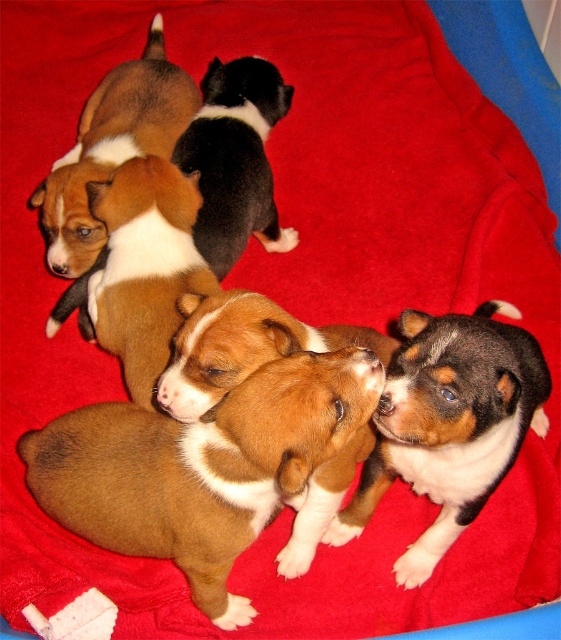
Does brown and white fur at center appear on the right side of black and white fur at center?

Correct, you'll find brown and white fur at center to the right of black and white fur at center.

Where is `brown and white fur at center`? brown and white fur at center is located at coordinates (448, 422).

Is brown/white fur puppy at center shorter than brown and white fur at center?

Yes.

Locate an element on the screen. brown/white fur puppy at center is located at coordinates (200, 467).

Can you confirm if brown/white fur puppy at center is positioned to the left of black and white fur at center?

Correct, you'll find brown/white fur puppy at center to the left of black and white fur at center.

Can you confirm if brown/white fur puppy at center is taller than black and white fur at center?

No.

Measure the distance between point (236, 493) and camera.

Point (236, 493) and camera are 1.09 meters apart from each other.

Where is `brown/white fur puppy at center`? Image resolution: width=561 pixels, height=640 pixels. brown/white fur puppy at center is located at coordinates (200, 467).